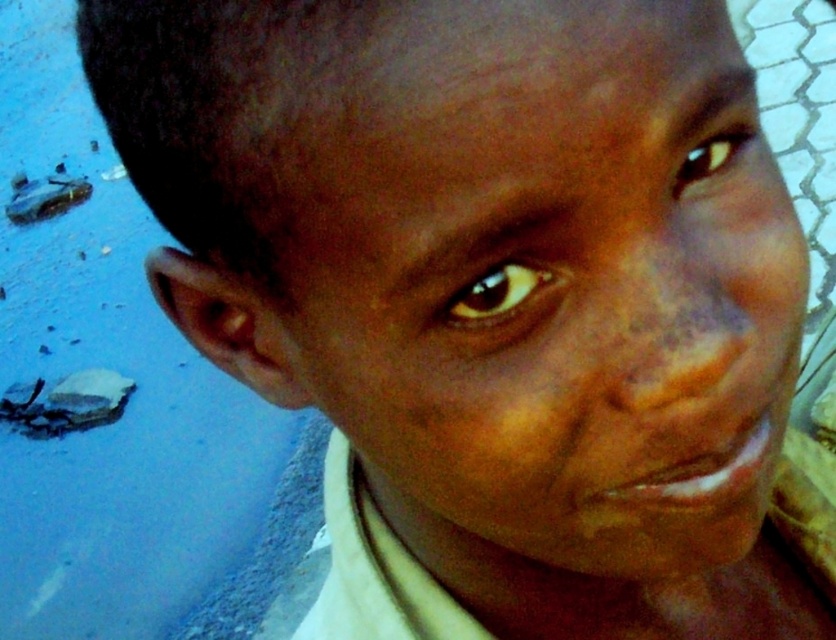
You are an artist sketching this person. You notice two points on their face. The first point is at coordinates point (477, 282) and the second is at point (709, 156). Which point is closer to the viewer?

Point (477, 282) is in front of point (709, 156), so it is closer to the viewer.

You are an artist trying to draw this person. You notice two brown eyes in the image. Which one is smaller in size between the brown glossy eye at center and the brown matte eye at upper right?

The brown glossy eye at center has a smaller size compared to the brown matte eye at upper right, so the brown glossy eye at center is the smaller one.

Looking at the person in the image, which object takes up more space in the scene? Mention both the smooth skin face at center and the brown matte eye at upper right in your answer.

The smooth skin face at center takes up more space in the scene compared to the brown matte eye at upper right because it has a larger size.